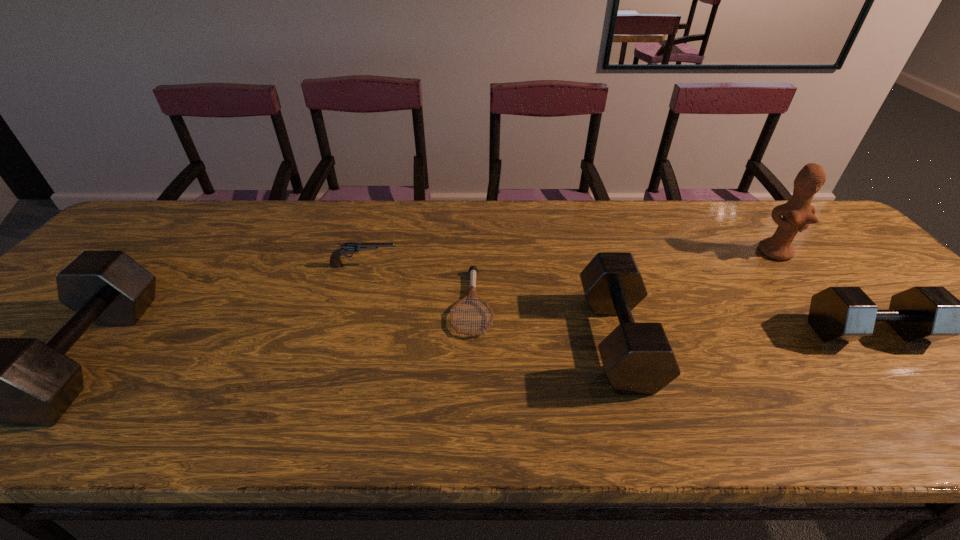
Where is `the second shortest dumbbell`? This screenshot has width=960, height=540. the second shortest dumbbell is located at coordinates (638, 359).

At what (x,y) coordinates should I click in order to perform the action: click on the third object from right to left. Please return your answer as a coordinate pair (x, y). Looking at the image, I should click on (638, 359).

What are the coordinates of `the shortest dumbbell` in the screenshot? It's located at (838, 313).

In order to click on the rightmost dumbbell in this screenshot , I will do `click(838, 313)`.

Where is `the farthest object`? This screenshot has width=960, height=540. the farthest object is located at coordinates (798, 213).

Image resolution: width=960 pixels, height=540 pixels. Find the location of `the tallest object`. the tallest object is located at coordinates (798, 213).

At what (x,y) coordinates should I click in order to perform the action: click on the second shortest object. Please return your answer as a coordinate pair (x, y). The image size is (960, 540). Looking at the image, I should click on (347, 248).

Where is `the second farthest object`? the second farthest object is located at coordinates (347, 248).

Find the location of `tennis racket`. tennis racket is located at coordinates (472, 295).

What are the coordinates of `the fourth object from right to left` in the screenshot? It's located at (472, 295).